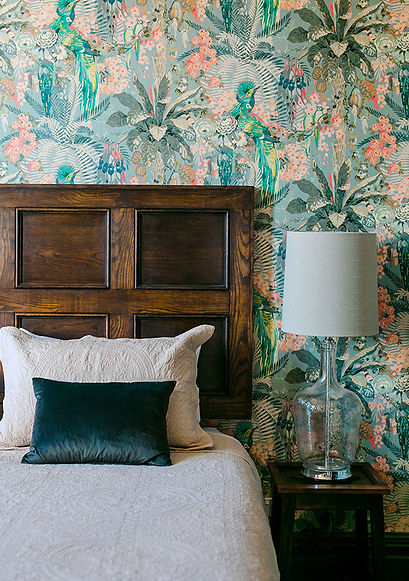
I want to click on big pillow, so click(131, 365).